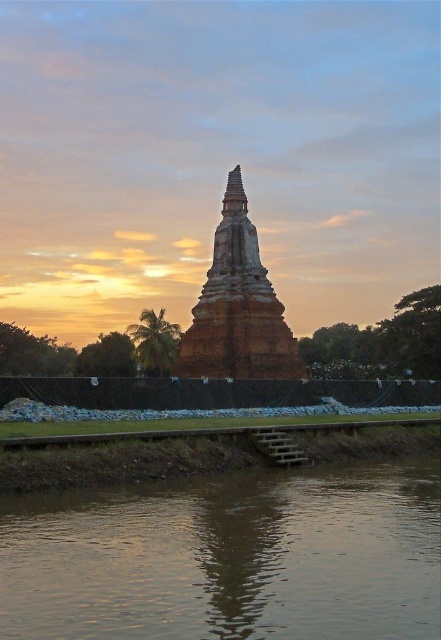
Question: Can you confirm if brown muddy water at lower center is positioned to the left of brown textured stone tower at center?

Choices:
 (A) no
 (B) yes

Answer: (A)

Question: Which point is closer to the camera?

Choices:
 (A) brown muddy water at lower center
 (B) brown textured stone tower at center

Answer: (A)

Question: Is brown muddy water at lower center below brown textured stone tower at center?

Choices:
 (A) no
 (B) yes

Answer: (B)

Question: Which of the following is the closest to the observer?

Choices:
 (A) brown textured stone tower at center
 (B) brown muddy water at lower center

Answer: (B)

Question: Is brown muddy water at lower center to the left of brown textured stone tower at center from the viewer's perspective?

Choices:
 (A) yes
 (B) no

Answer: (B)

Question: Among these objects, which one is farthest from the camera?

Choices:
 (A) brown textured stone tower at center
 (B) brown muddy water at lower center

Answer: (A)